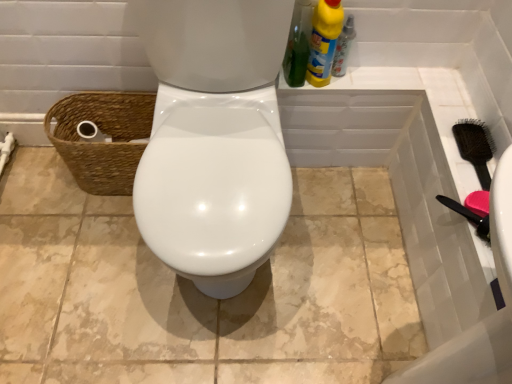
Question: From the image's perspective, would you say yellow plastic bottle at upper right, placed as the first cleaning product when sorted from right to left, is shown under yellow plastic bottle at upper right?

Choices:
 (A) no
 (B) yes

Answer: (A)

Question: Is yellow plastic bottle at upper right surrounded by yellow plastic bottle at upper right, placed as the first cleaning product when sorted from right to left?

Choices:
 (A) no
 (B) yes

Answer: (A)

Question: Is yellow plastic bottle at upper right, placed as the first cleaning product when sorted from right to left, in contact with yellow plastic bottle at upper right?

Choices:
 (A) yes
 (B) no

Answer: (A)

Question: From a real-world perspective, is yellow plastic bottle at upper right, placed as the 2th cleaning product when sorted from left to right, located beneath yellow plastic bottle at upper right?

Choices:
 (A) yes
 (B) no

Answer: (B)

Question: Is yellow plastic bottle at upper right, placed as the first cleaning product when sorted from right to left, facing towards yellow plastic bottle at upper right?

Choices:
 (A) yes
 (B) no

Answer: (B)

Question: Does yellow plastic bottle at upper right, placed as the first cleaning product when sorted from right to left, lie behind yellow plastic bottle at upper right?

Choices:
 (A) no
 (B) yes

Answer: (A)

Question: Does black plastic brush at right have a lesser width compared to yellow plastic bottle at upper right, placed as the 2th cleaning product when sorted from left to right?

Choices:
 (A) no
 (B) yes

Answer: (B)

Question: Is black plastic brush at right positioned beyond the bounds of yellow plastic bottle at upper right, placed as the 2th cleaning product when sorted from left to right?

Choices:
 (A) yes
 (B) no

Answer: (A)

Question: From the image's perspective, does black plastic brush at right appear lower than yellow plastic bottle at upper right, placed as the first cleaning product when sorted from right to left?

Choices:
 (A) yes
 (B) no

Answer: (A)

Question: Is black plastic brush at right taller than yellow plastic bottle at upper right, placed as the first cleaning product when sorted from right to left?

Choices:
 (A) no
 (B) yes

Answer: (A)

Question: Considering the relative sizes of black plastic brush at right and yellow plastic bottle at upper right, placed as the 2th cleaning product when sorted from left to right, in the image provided, is black plastic brush at right shorter than yellow plastic bottle at upper right, placed as the 2th cleaning product when sorted from left to right,?

Choices:
 (A) yes
 (B) no

Answer: (A)

Question: From a real-world perspective, is black plastic brush at right under yellow plastic bottle at upper right, placed as the first cleaning product when sorted from right to left?

Choices:
 (A) yes
 (B) no

Answer: (A)

Question: Is yellow liquid cleaner at upper right, which is the first cleaning product in left-to-right order, turned away from black plastic brush at right?

Choices:
 (A) no
 (B) yes

Answer: (A)